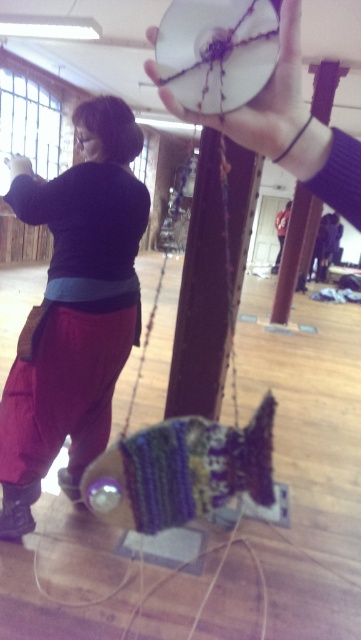
Question: Is matte black sweater at left wider than white matte disc at upper center?

Choices:
 (A) yes
 (B) no

Answer: (A)

Question: Estimate the real-world distances between objects in this image. Which object is closer to the matte black sweater at left?

Choices:
 (A) matte black hand at upper center
 (B) white matte disc at upper center

Answer: (A)

Question: In this image, where is matte black sweater at left located relative to white matte disc at upper center?

Choices:
 (A) below
 (B) above

Answer: (A)

Question: Is matte black sweater at left closer to the viewer compared to matte black hand at upper center?

Choices:
 (A) yes
 (B) no

Answer: (A)

Question: Which object is positioned farthest from the matte black sweater at left?

Choices:
 (A) white matte disc at upper center
 (B) matte black hand at upper center

Answer: (A)

Question: Which object is farther from the camera taking this photo?

Choices:
 (A) matte black hand at upper center
 (B) matte black sweater at left

Answer: (A)